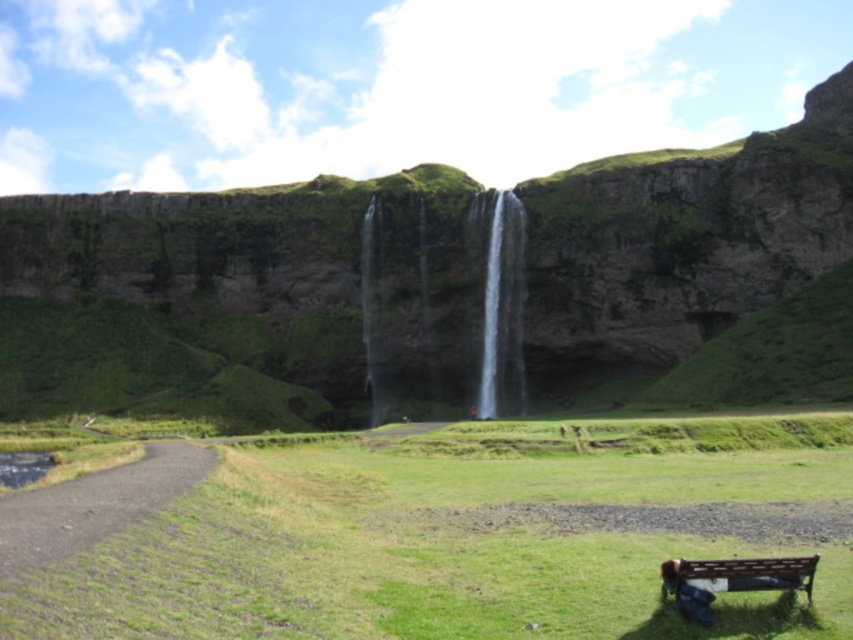
Looking at this image, does green grassy field at center have a greater height compared to transparent water at center?

No.

Does green grassy field at center have a larger size compared to transparent water at center?

Correct, green grassy field at center is larger in size than transparent water at center.

Between point (451, 636) and point (503, 269), which one is positioned in front?

Positioned in front is point (451, 636).

Where is `green grassy field at center`? The height and width of the screenshot is (640, 853). green grassy field at center is located at coordinates (451, 547).

Find the location of a particular element. green grassy field at center is located at coordinates (451, 547).

Does point (424, 637) come closer to viewer compared to point (415, 320)?

Yes, point (424, 637) is in front of point (415, 320).

This screenshot has width=853, height=640. Find the location of `green grassy field at center`. green grassy field at center is located at coordinates (451, 547).

Which is in front, point (444, 387) or point (28, 531)?

Point (28, 531)

I want to click on clear water at center, so click(445, 312).

You are a GUI agent. You are given a task and a screenshot of the screen. Output one action in this format:
    pyautogui.click(x=<x>, y=<y>)
    Task: Click on the clear water at center
    The height and width of the screenshot is (640, 853).
    Given the screenshot: What is the action you would take?
    pyautogui.click(x=445, y=312)